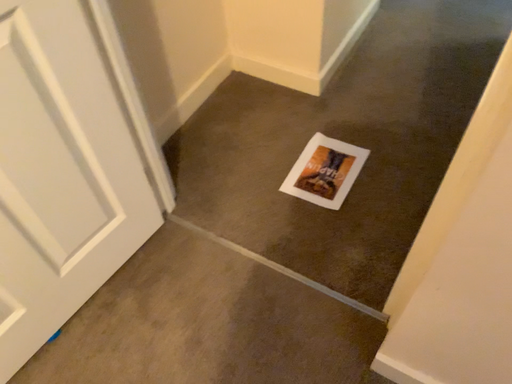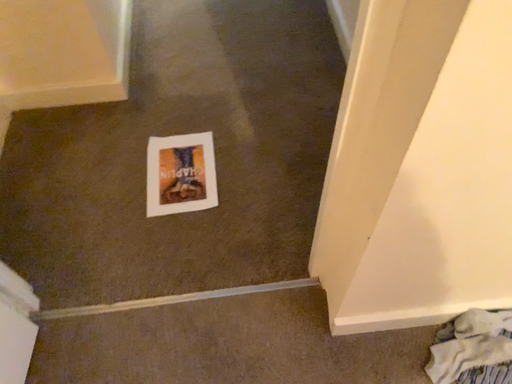
Question: How did the camera likely rotate when shooting the video?

Choices:
 (A) rotated right
 (B) rotated left

Answer: (A)